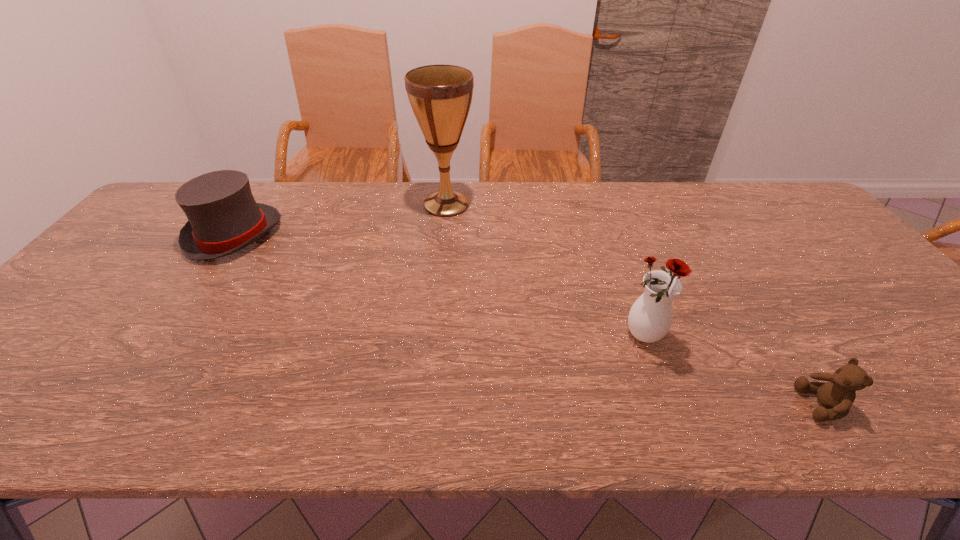
Where is `the tallest object`? The height and width of the screenshot is (540, 960). the tallest object is located at coordinates (440, 95).

Locate an element on the screen. This screenshot has width=960, height=540. the second object from left to right is located at coordinates (440, 95).

Where is `the third shortest object`? the third shortest object is located at coordinates (650, 318).

This screenshot has width=960, height=540. I want to click on vase, so click(x=650, y=318).

I want to click on dress hat, so click(223, 215).

Find the location of a particular element. the leftmost object is located at coordinates (223, 215).

Where is `the shortest object`? the shortest object is located at coordinates (836, 396).

Find the location of `the nearest object`. the nearest object is located at coordinates (836, 396).

The height and width of the screenshot is (540, 960). Identify the location of vacant region located on the left of the third object from right to left. (317, 205).

This screenshot has height=540, width=960. In order to click on vacant space located 0.060m on the back of the third shortest object in this screenshot , I will do `click(634, 302)`.